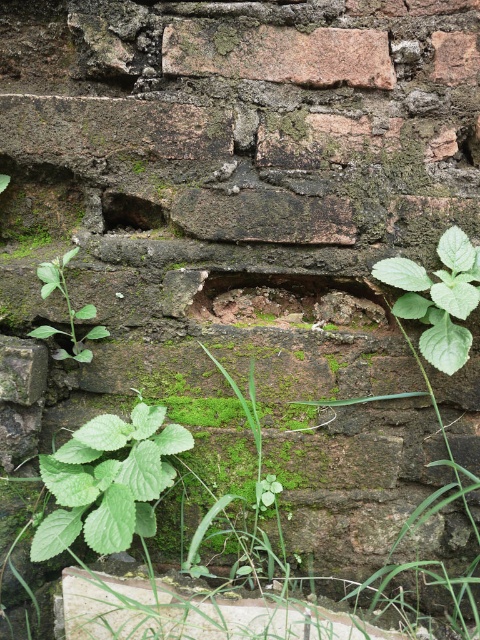
Question: Does green leafy plant at lower left appear on the left side of green matte plant at left?

Choices:
 (A) no
 (B) yes

Answer: (A)

Question: Which point is farther from the camera taking this photo?

Choices:
 (A) (87, 456)
 (B) (247, 28)
 (C) (435, 355)
 (D) (71, 323)

Answer: (D)

Question: Is rusty stone brick at upper center to the right of green leafy plant at lower right from the viewer's perspective?

Choices:
 (A) yes
 (B) no

Answer: (B)

Question: From the image, what is the correct spatial relationship of green leafy plant at lower right in relation to green matte plant at left?

Choices:
 (A) right
 (B) left

Answer: (A)

Question: Which point is closer to the camera?

Choices:
 (A) (168, 465)
 (B) (171, 35)

Answer: (A)

Question: Which object is farther from the camera taking this photo?

Choices:
 (A) green leafy plant at lower left
 (B) green leafy plant at lower right

Answer: (B)